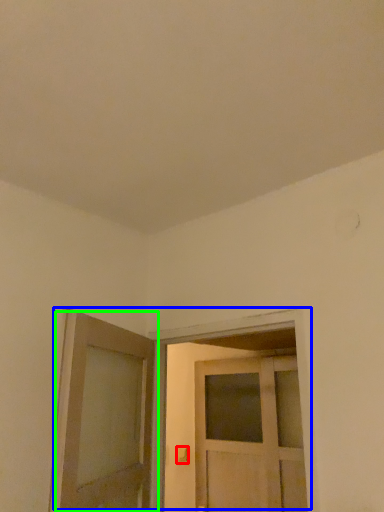
Question: Which object is the farthest from door handle (highlighted by a red box)? Choose among these: door (highlighted by a blue box) or door (highlighted by a green box).

Choices:
 (A) door
 (B) door

Answer: (B)